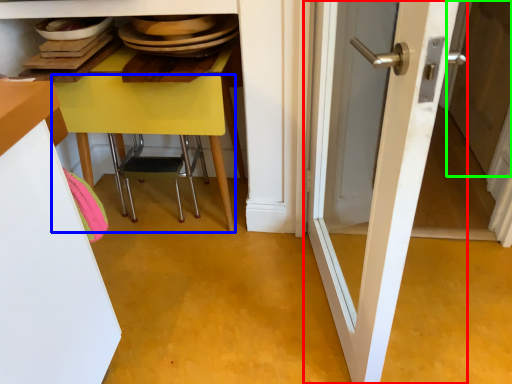
Question: Which object is the farthest from door (highlighted by a red box)? Choose among these: table (highlighted by a blue box) or screen door (highlighted by a green box).

Choices:
 (A) table
 (B) screen door

Answer: (B)